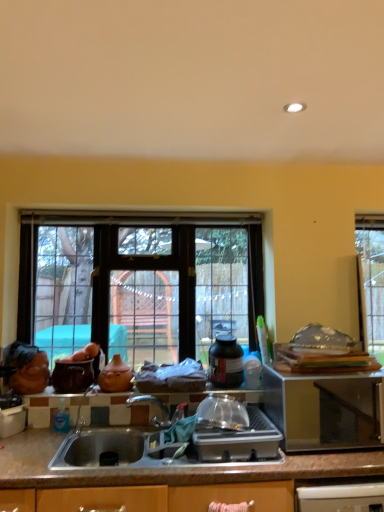
In order to face blue translucent bottle at sink, the second bottle viewed from the right, should I rotate leftwards or rightwards?

To face it directly, rotate left by 17.066 degrees.

At what (x,y) coordinates should I click in order to perform the action: click on blue translucent bottle at sink, which is counted as the 1th bottle, starting from the bottom. Please return your answer as a coordinate pair (x, y). The width and height of the screenshot is (384, 512). Looking at the image, I should click on (61, 418).

Measure the distance between point (62, 397) and camera.

Point (62, 397) is 7.19 feet from camera.

This screenshot has height=512, width=384. I want to click on brown granite countertop at lower center, so click(x=164, y=480).

Does point (55, 364) appear closer or farther from the camera than point (257, 408)?

Clearly, point (55, 364) is more distant from the camera than point (257, 408).

Is matte brown pot at left, which is the 2th appliance from right to left, completely or partially outside of clear plastic container at center?

Indeed, matte brown pot at left, which is the 2th appliance from right to left, is completely outside clear plastic container at center.

From the picture: From the image's perspective, which one is positioned higher, matte brown pot at left, which is the 2th appliance from right to left, or clear plastic container at center?

matte brown pot at left, which is the 2th appliance from right to left, is shown above in the image.

Is matte brown pot at left, which is the 2th appliance from right to left, positioned with its back to clear plastic container at center?

That's not correct — matte brown pot at left, which is the 2th appliance from right to left, is not looking away from clear plastic container at center.

From the image's perspective, is blue translucent bottle at sink, which is counted as the 1th bottle, starting from the bottom, located above or below matte brown pot at left, which is the first appliance from left to right?

Based on their image positions, blue translucent bottle at sink, which is counted as the 1th bottle, starting from the bottom, is located beneath matte brown pot at left, which is the first appliance from left to right.

Considering the relative positions of blue translucent bottle at sink, which is the 2th bottle in top-to-bottom order, and matte brown pot at left, which is the first appliance from left to right, in the image provided, is blue translucent bottle at sink, which is the 2th bottle in top-to-bottom order, to the left or to the right of matte brown pot at left, which is the first appliance from left to right,?

In the image, blue translucent bottle at sink, which is the 2th bottle in top-to-bottom order, appears on the left side of matte brown pot at left, which is the first appliance from left to right.

Which of these two, blue translucent bottle at sink, the 1th bottle in the front-to-back sequence, or matte brown pot at left, which is the first appliance from left to right, is bigger?

With larger size is matte brown pot at left, which is the first appliance from left to right.

Does blue translucent bottle at sink, the 1th bottle in the front-to-back sequence, have a lesser height compared to matte brown pot at left, which is the 2th appliance from right to left?

Yes, blue translucent bottle at sink, the 1th bottle in the front-to-back sequence, is shorter than matte brown pot at left, which is the 2th appliance from right to left.

Considering the sizes of clear glass window at center and matte brown pot at left, which is the first appliance from left to right, in the image, is clear glass window at center taller or shorter than matte brown pot at left, which is the first appliance from left to right,?

In the image, clear glass window at center appears to be taller than matte brown pot at left, which is the first appliance from left to right.

Between clear glass window at center and matte brown pot at left, which is the 2th appliance from right to left, which one has smaller size?

matte brown pot at left, which is the 2th appliance from right to left.

Which is behind, clear glass window at center or matte brown pot at left, which is the 2th appliance from right to left?

clear glass window at center is further from the camera.

From the image's perspective, between clear glass window at center and matte brown pot at left, which is the first appliance from left to right, which one is located above?

From the image's view, clear glass window at center is above.

Is matte brown pot at left, which is the first appliance from left to right, with brown granite countertop at lower center?

There is a gap between matte brown pot at left, which is the first appliance from left to right, and brown granite countertop at lower center.

How different are the orientations of matte brown pot at left, which is the first appliance from left to right, and brown granite countertop at lower center in degrees?

They differ by 0.462 degrees in their facing directions.

From the image's perspective, does matte brown pot at left, which is the 2th appliance from right to left, appear higher than brown granite countertop at lower center?

Indeed, from the image's perspective, matte brown pot at left, which is the 2th appliance from right to left, is shown above brown granite countertop at lower center.

In terms of size, does matte brown pot at left, which is the first appliance from left to right, appear bigger or smaller than brown granite countertop at lower center?

In the image, matte brown pot at left, which is the first appliance from left to right, appears to be smaller than brown granite countertop at lower center.

Is blue translucent bottle at sink, the 1th bottle in the front-to-back sequence, located within brown granite countertop at lower center?

Definitely not — blue translucent bottle at sink, the 1th bottle in the front-to-back sequence, is not inside brown granite countertop at lower center.

Considering the relative sizes of brown granite countertop at lower center and blue translucent bottle at sink, which is counted as the 1th bottle, starting from the bottom, in the image provided, is brown granite countertop at lower center wider than blue translucent bottle at sink, which is counted as the 1th bottle, starting from the bottom,?

Indeed, brown granite countertop at lower center has a greater width compared to blue translucent bottle at sink, which is counted as the 1th bottle, starting from the bottom.

Is brown granite countertop at lower center looking in the opposite direction of blue translucent bottle at sink, acting as the first bottle starting from the left?

No, blue translucent bottle at sink, acting as the first bottle starting from the left, is not at the back of brown granite countertop at lower center.

Is brown granite countertop at lower center taller or shorter than blue translucent bottle at sink, the 1th bottle in the front-to-back sequence?

Considering their sizes, brown granite countertop at lower center has more height than blue translucent bottle at sink, the 1th bottle in the front-to-back sequence.

Is clear glass window at center next to stainless steel microwave at right, which ranks as the second appliance in left-to-right order, and touching it?

No, clear glass window at center is not beside stainless steel microwave at right, which ranks as the second appliance in left-to-right order.

Measure the distance from clear glass window at center to stainless steel microwave at right, positioned as the first appliance in right-to-left order.

36.27 inches.

Looking at the image, does clear glass window at center seem bigger or smaller compared to stainless steel microwave at right, positioned as the first appliance in right-to-left order?

clear glass window at center is bigger than stainless steel microwave at right, positioned as the first appliance in right-to-left order.

Can you tell me how much clear glass window at center and stainless steel microwave at right, which ranks as the second appliance in left-to-right order, differ in facing direction?

The angle between the facing direction of clear glass window at center and the facing direction of stainless steel microwave at right, which ranks as the second appliance in left-to-right order, is 1.95 degrees.

In the scene shown: From the image's perspective, does matte brown pot at left, which is the first appliance from left to right, appear lower than stainless steel microwave at right, positioned as the first appliance in right-to-left order?

No, from the image's perspective, matte brown pot at left, which is the first appliance from left to right, is not below stainless steel microwave at right, positioned as the first appliance in right-to-left order.

Consider the image. Can you confirm if matte brown pot at left, which is the first appliance from left to right, is positioned to the right of stainless steel microwave at right, which ranks as the second appliance in left-to-right order?

No.

Does matte brown pot at left, which is the 2th appliance from right to left, touch stainless steel microwave at right, positioned as the first appliance in right-to-left order?

No, matte brown pot at left, which is the 2th appliance from right to left, is not making contact with stainless steel microwave at right, positioned as the first appliance in right-to-left order.

Is stainless steel microwave at right, which ranks as the second appliance in left-to-right order, located within matte brown pot at left, which is the first appliance from left to right?

That's incorrect, stainless steel microwave at right, which ranks as the second appliance in left-to-right order, is not inside matte brown pot at left, which is the first appliance from left to right.

The image size is (384, 512). What are the coordinates of `the 2nd appliance behind the clear plastic container at center, counting from the anchor's position` in the screenshot? It's located at (72, 375).

From the image's perspective, count 2nd appliances upward from the blue translucent bottle at sink, which is counted as the 1th bottle, starting from the bottom, and point to it. Please provide its 2D coordinates.

[(72, 375)]

From the image, which object appears to be nearer to clear plastic container at center, clear glass window at center or matte ceramic vase at center?

Based on the image, matte ceramic vase at center appears to be nearer to clear plastic container at center.

Considering their positions, is matte ceramic vase at center positioned further to stainless steel microwave at right, positioned as the first appliance in right-to-left order, than blue translucent bottle at sink, which is the 2th bottle in top-to-bottom order?

The object further to stainless steel microwave at right, positioned as the first appliance in right-to-left order, is blue translucent bottle at sink, which is the 2th bottle in top-to-bottom order.

Considering their positions, is clear plastic container at center positioned further to brown granite countertop at lower center than blue translucent bottle at sink, the 1th bottle in the front-to-back sequence?

The object further to brown granite countertop at lower center is blue translucent bottle at sink, the 1th bottle in the front-to-back sequence.

Estimate the real-world distances between objects in this image. Which object is further from brown granite countertop at lower center, blue translucent bottle at sink, marked as the second bottle in a back-to-front arrangement, or stainless steel microwave at right, positioned as the first appliance in right-to-left order?

stainless steel microwave at right, positioned as the first appliance in right-to-left order, is further to brown granite countertop at lower center.

Estimate the real-world distances between objects in this image. Which object is further from matte black bottle at center, acting as the 1th bottle starting from the back, stainless steel microwave at right, which ranks as the second appliance in left-to-right order, or clear plastic container at center?

Among the two, stainless steel microwave at right, which ranks as the second appliance in left-to-right order, is located further to matte black bottle at center, acting as the 1th bottle starting from the back.

From the picture: When comparing their distances from matte black bottle at center, acting as the 1th bottle starting from the back, does clear plastic container at center or matte brown pot at left, which is the first appliance from left to right, seem further?

matte brown pot at left, which is the first appliance from left to right.

From the image, which object appears to be farther from clear plastic container at center, blue translucent bottle at sink, acting as the first bottle starting from the left, or matte ceramic vase at center?

blue translucent bottle at sink, acting as the first bottle starting from the left, is positioned further to the anchor clear plastic container at center.

In the scene shown: Estimate the real-world distances between objects in this image. Which object is closer to blue translucent bottle at sink, marked as the second bottle in a back-to-front arrangement, brown granite countertop at lower center or clear glass window at center?

brown granite countertop at lower center is closer to blue translucent bottle at sink, marked as the second bottle in a back-to-front arrangement.

Identify the location of window located between matte ceramic vase at center and stainless steel microwave at right, positioned as the first appliance in right-to-left order, in the left-right direction. This screenshot has height=512, width=384. (140, 286).

Find the location of a particular element. Image resolution: width=384 pixels, height=512 pixels. countertop situated between matte brown pot at left, which is the 2th appliance from right to left, and clear plastic container at center from left to right is located at coordinates (164, 480).

Identify the location of bottle situated between blue translucent bottle at sink, marked as the second bottle in a back-to-front arrangement, and stainless steel microwave at right, which ranks as the second appliance in left-to-right order, from left to right. The height and width of the screenshot is (512, 384). (226, 362).

The image size is (384, 512). What are the coordinates of `window sill situated between blue translucent bottle at sink, acting as the first bottle starting from the left, and matte black bottle at center, placed as the 1th bottle when sorted from right to left, from left to right` in the screenshot? It's located at (220, 394).